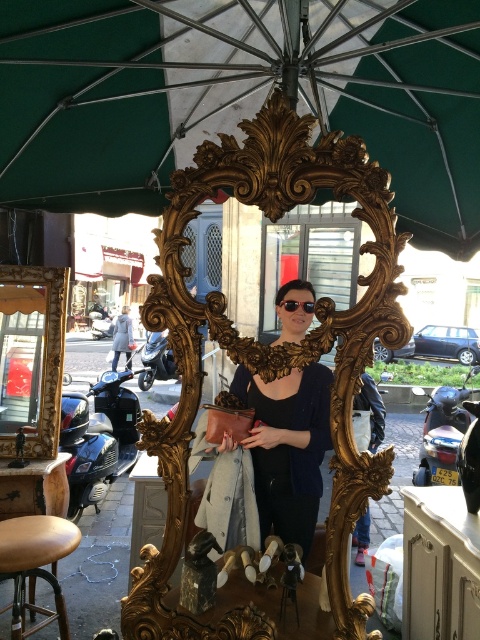
Question: Does green fabric umbrella at upper center have a larger size compared to brown leather stool at lower left?

Choices:
 (A) no
 (B) yes

Answer: (B)

Question: Can you confirm if green fabric umbrella at upper center is bigger than matte black sunglasses at center?

Choices:
 (A) yes
 (B) no

Answer: (A)

Question: Which point is farther to the camera?

Choices:
 (A) matte black sunglasses at center
 (B) gold ornate mirror at center

Answer: (A)

Question: Which of the following is the closest to the observer?

Choices:
 (A) (20, 612)
 (B) (171, 602)
 (C) (300, 397)
 (D) (284, 300)

Answer: (D)

Question: Does matte black sunglasses at center lie in front of sunglasses at center?

Choices:
 (A) yes
 (B) no

Answer: (B)

Question: Which object is positioned farthest from the gold ornate mirror at center?

Choices:
 (A) matte black sunglasses at center
 (B) green fabric umbrella at upper center
 (C) brown leather stool at lower left
 (D) sunglasses at center

Answer: (C)